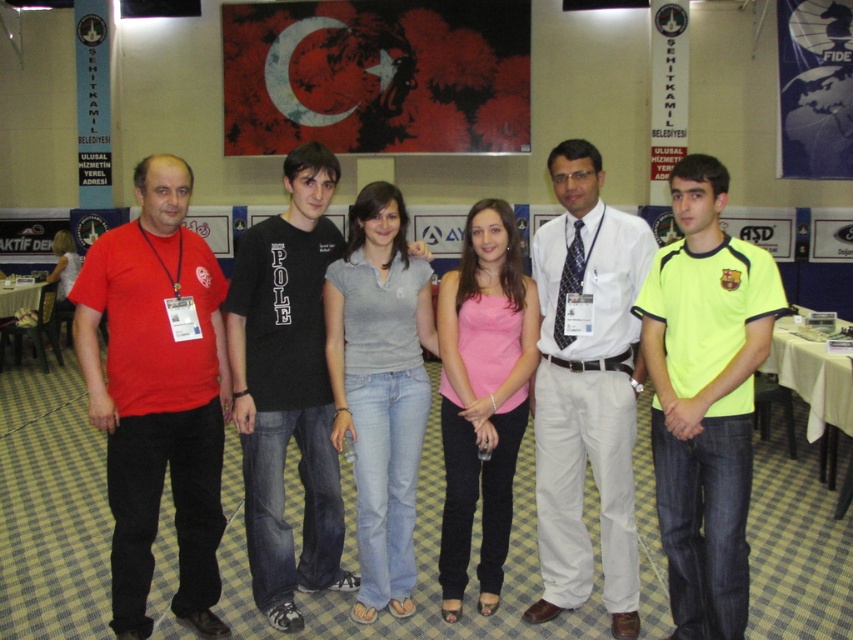
Which is behind, point (276, 305) or point (27, 310)?

The point (27, 310) is more distant.

Is black cotton t-shirt at center behind wooden table at left?

No, black cotton t-shirt at center is in front of wooden table at left.

Identify the location of black cotton t-shirt at center. Image resolution: width=853 pixels, height=640 pixels. (287, 388).

Where is `black cotton t-shirt at center`? Image resolution: width=853 pixels, height=640 pixels. black cotton t-shirt at center is located at coordinates (287, 388).

Is the position of black cotton t-shirt at center less distant than that of white cloth-covered table at lower right?

That is True.

Who is taller, black cotton t-shirt at center or white cloth-covered table at lower right?

black cotton t-shirt at center is taller.

This screenshot has width=853, height=640. What do you see at coordinates (287, 388) in the screenshot? I see `black cotton t-shirt at center` at bounding box center [287, 388].

Locate an element on the screen. black cotton t-shirt at center is located at coordinates (287, 388).

Which is in front, point (206, 534) or point (619, 444)?

Positioned in front is point (619, 444).

Can you confirm if matte red t-shirt at left is thinner than white cotton shirt at center?

Incorrect, matte red t-shirt at left's width is not less than white cotton shirt at center's.

At what (x,y) coordinates should I click in order to perform the action: click on matte red t-shirt at left. Please return your answer as a coordinate pair (x, y). This screenshot has width=853, height=640. Looking at the image, I should click on (157, 394).

This screenshot has height=640, width=853. In order to click on matte red t-shirt at left in this screenshot , I will do pos(157,394).